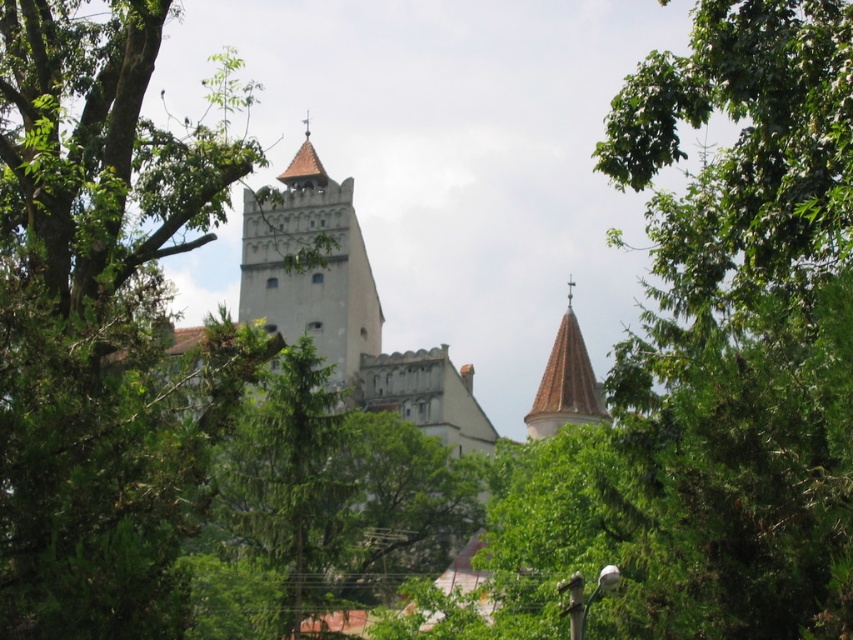
Between white stone tower at center and white stucco tower at upper center, which one is positioned lower?

Positioned lower is white stucco tower at upper center.

Between point (374, 323) and point (570, 378), which one is positioned behind?

The point (374, 323) is more distant.

The width and height of the screenshot is (853, 640). What are the coordinates of `white stone tower at center` in the screenshot? It's located at (311, 268).

Between green leafy tree at center and white stone tower at center, which one appears on the left side from the viewer's perspective?

From the viewer's perspective, green leafy tree at center appears more on the left side.

Is green leafy tree at center taller than white stone tower at center?

Yes, green leafy tree at center is taller than white stone tower at center.

What do you see at coordinates (97, 326) in the screenshot?
I see `green leafy tree at center` at bounding box center [97, 326].

This screenshot has width=853, height=640. I want to click on green leafy tree at center, so click(x=97, y=326).

Can you confirm if green leafy tree at center is thinner than white stucco tower at upper center?

No, green leafy tree at center is not thinner than white stucco tower at upper center.

Between green leafy tree at center and white stucco tower at upper center, which one appears on the left side from the viewer's perspective?

green leafy tree at center is more to the left.

What do you see at coordinates (97, 326) in the screenshot?
I see `green leafy tree at center` at bounding box center [97, 326].

I want to click on green leafy tree at center, so click(97, 326).